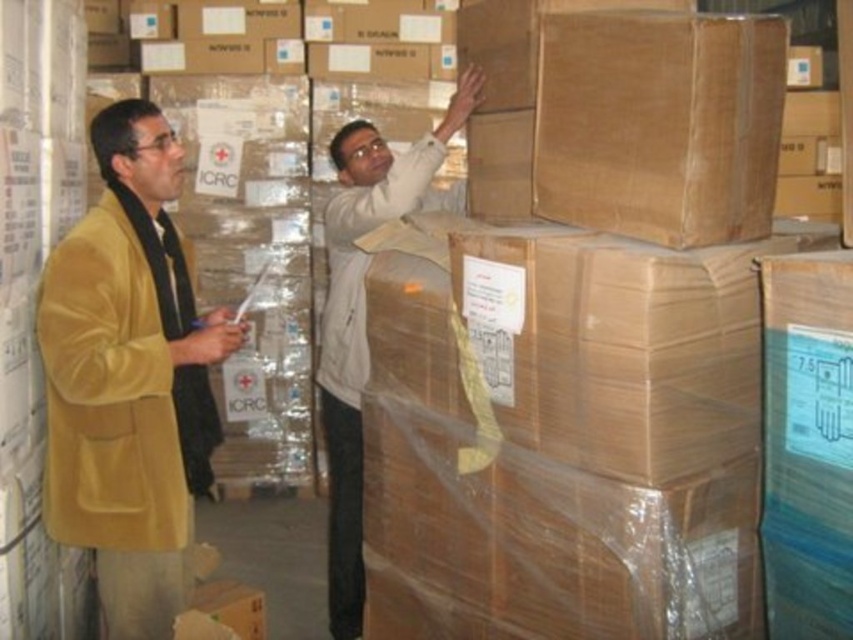
You are a warehouse worker who needs to retrieve both the velvet gold coat at left and the white matte jacket at upper center. Which item is positioned higher in the storage area?

The white matte jacket at upper center is positioned higher than the velvet gold coat at left.

What are the coordinates of the velvet gold coat at left in the image?

The velvet gold coat at left is located at coordinates point (129,378).

You are a warehouse worker who needs to move a box that is 30 inches wide. There is a velvet gold coat at left and a light beige fabric shirt at upper center in the way. Can the box fit between them?

The distance between the velvet gold coat at left and the light beige fabric shirt at upper center is 32.23 inches. Since the box is 30 inches wide, it should fit between them with about 2.23 inches of space remaining.